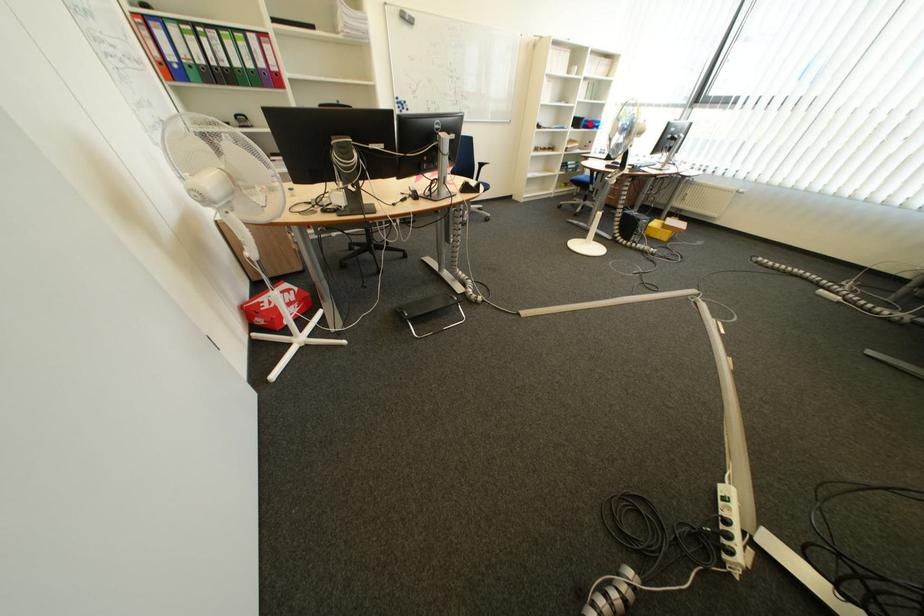
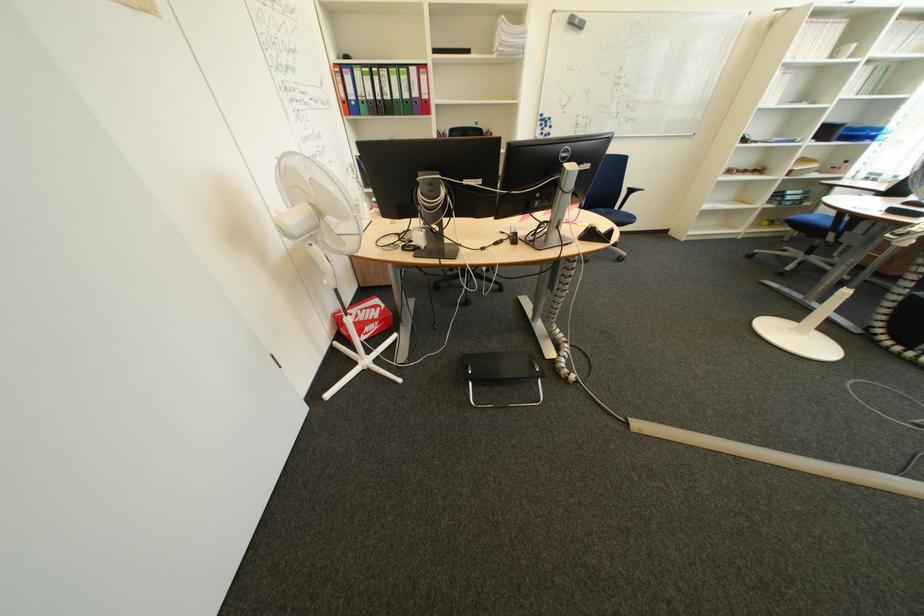
Question: I am providing you with two images of the same scene from different viewpoints. Given a red point in image1, look at the same physical point in image2. Is it:

Choices:
 (A) Closer to the viewpoint
 (B) Farther from the viewpoint

Answer: (B)